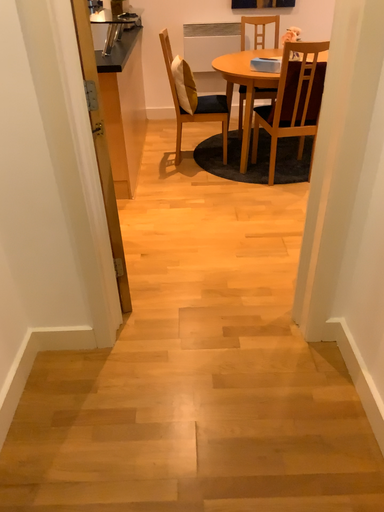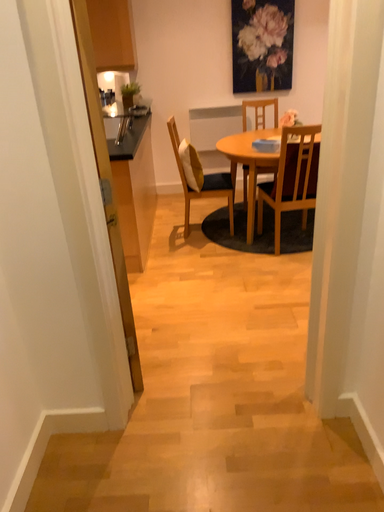
Question: Which way did the camera rotate in the video?

Choices:
 (A) rotated upward
 (B) rotated downward

Answer: (A)